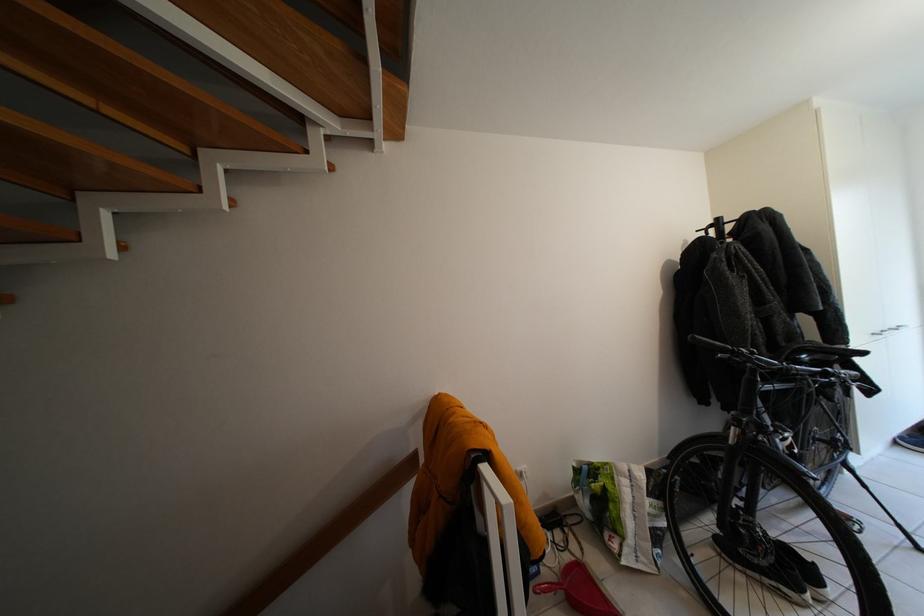
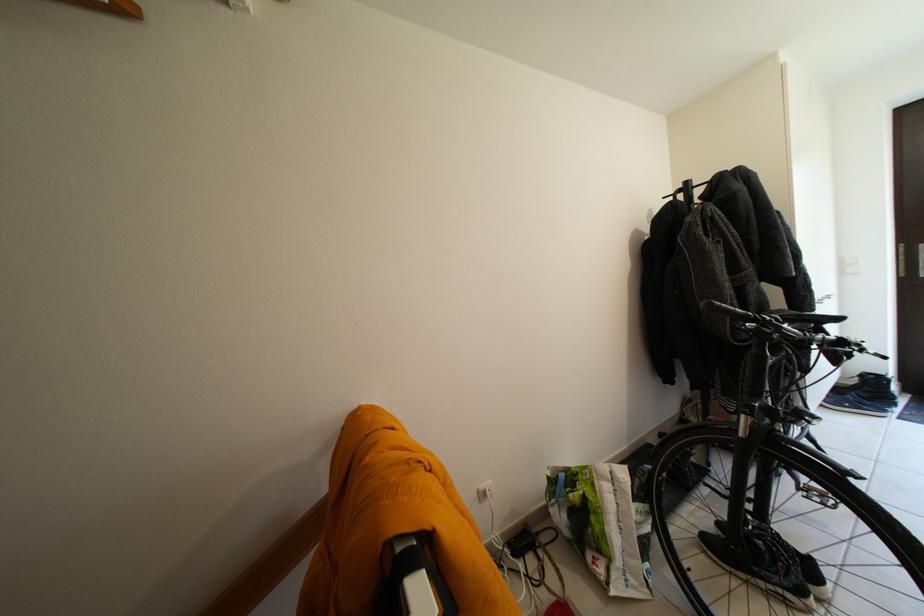
Find the pixel in the second image that matches point (527, 474) in the first image.

(490, 493)